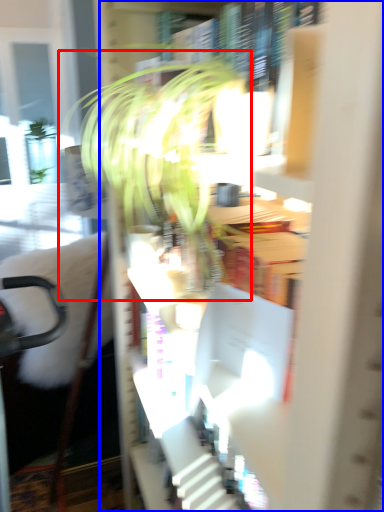
Question: Which object is closer to the camera taking this photo, houseplant (highlighted by a red box) or bookcase (highlighted by a blue box)?

Choices:
 (A) houseplant
 (B) bookcase

Answer: (B)